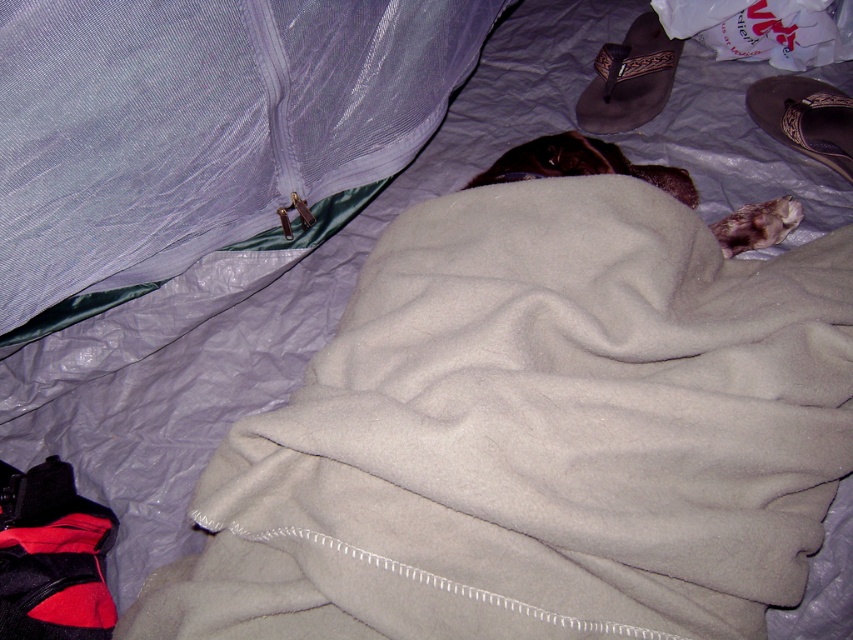
From the picture: Does translucent purple fabric at upper left come behind fuzzy brown cat at center?

No.

Based on the photo, can you confirm if translucent purple fabric at upper left is shorter than fuzzy brown cat at center?

No, translucent purple fabric at upper left is not shorter than fuzzy brown cat at center.

Image resolution: width=853 pixels, height=640 pixels. What do you see at coordinates (200, 124) in the screenshot?
I see `translucent purple fabric at upper left` at bounding box center [200, 124].

The width and height of the screenshot is (853, 640). Find the location of `translucent purple fabric at upper left`. translucent purple fabric at upper left is located at coordinates (200, 124).